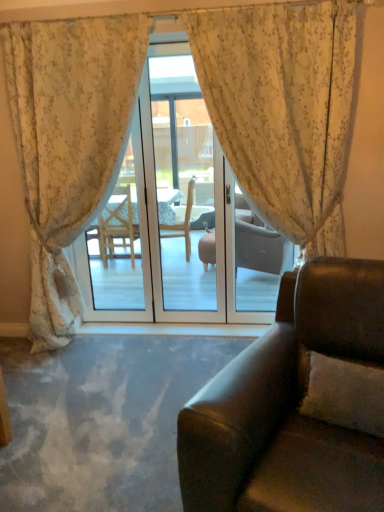
Question: Can you confirm if white textured pillow at lower right is bigger than floral fabric curtain at center, placed as the first curtain when sorted from left to right?

Choices:
 (A) no
 (B) yes

Answer: (A)

Question: Is white textured pillow at lower right completely or partially outside of floral fabric curtain at center, which is the second curtain in right-to-left order?

Choices:
 (A) no
 (B) yes

Answer: (B)

Question: Is white textured pillow at lower right smaller than floral fabric curtain at center, which is the second curtain in right-to-left order?

Choices:
 (A) no
 (B) yes

Answer: (B)

Question: Would you say white textured pillow at lower right is a long distance from floral fabric curtain at center, which is the second curtain in right-to-left order?

Choices:
 (A) no
 (B) yes

Answer: (B)

Question: From the image's perspective, would you say white textured pillow at lower right is shown under floral fabric curtain at center, placed as the first curtain when sorted from left to right?

Choices:
 (A) no
 (B) yes

Answer: (B)

Question: In terms of size, does leather couch at lower right appear bigger or smaller than transparent glass door at center?

Choices:
 (A) big
 (B) small

Answer: (A)

Question: From the image's perspective, relative to transparent glass door at center, is leather couch at lower right above or below?

Choices:
 (A) above
 (B) below

Answer: (B)

Question: Is leather couch at lower right in front of or behind transparent glass door at center in the image?

Choices:
 (A) front
 (B) behind

Answer: (A)

Question: Considering the positions of leather couch at lower right and transparent glass door at center in the image, is leather couch at lower right wider or thinner than transparent glass door at center?

Choices:
 (A) thin
 (B) wide

Answer: (B)

Question: Is point (29, 152) positioned closer to the camera than point (317, 386)?

Choices:
 (A) farther
 (B) closer

Answer: (A)

Question: Looking at the image, does floral fabric curtain at center, placed as the first curtain when sorted from left to right, seem bigger or smaller compared to white textured pillow at lower right?

Choices:
 (A) big
 (B) small

Answer: (A)

Question: From the image's perspective, is floral fabric curtain at center, which is the second curtain in right-to-left order, located above or below white textured pillow at lower right?

Choices:
 (A) above
 (B) below

Answer: (A)

Question: Is floral fabric curtain at center, which is the second curtain in right-to-left order, inside or outside of white textured pillow at lower right?

Choices:
 (A) inside
 (B) outside

Answer: (B)

Question: From a real-world perspective, is floral fabric curtain at center, which is the second curtain in right-to-left order, above or below transparent glass door at center?

Choices:
 (A) above
 (B) below

Answer: (A)

Question: From the image's perspective, is floral fabric curtain at center, which is the second curtain in right-to-left order, located above or below transparent glass door at center?

Choices:
 (A) below
 (B) above

Answer: (A)